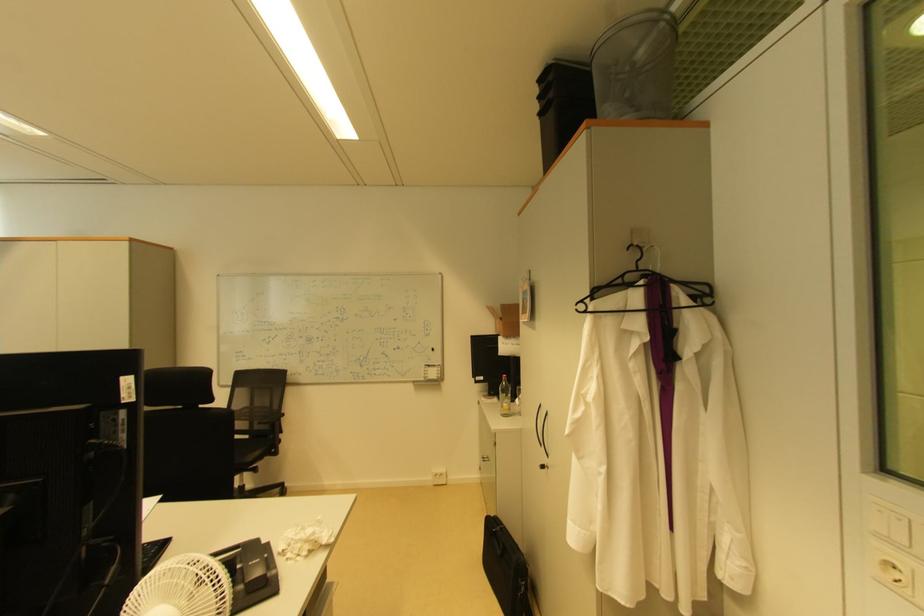
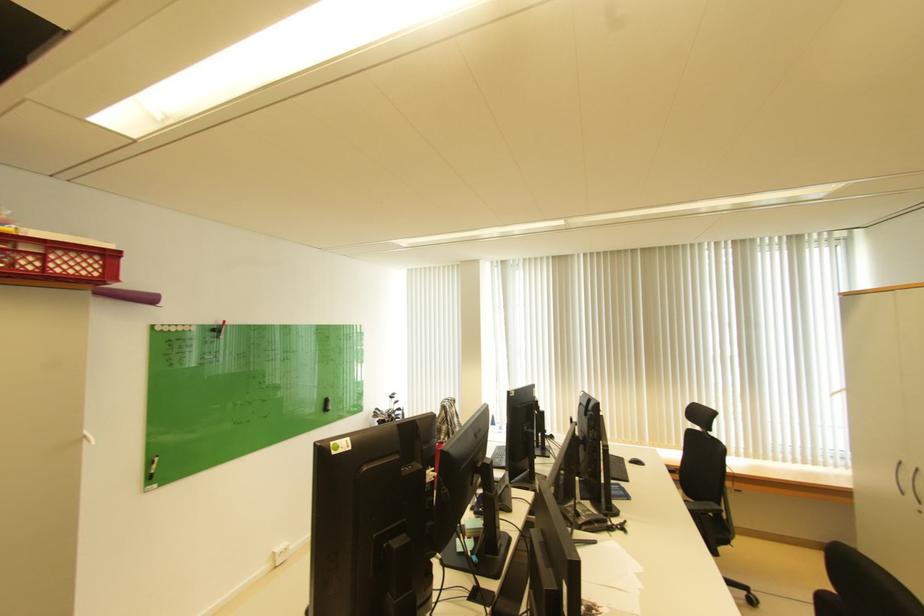
Question: The camera is either moving clockwise (left) or counter-clockwise (right) around the object. The first image is from the beginning of the video and the second image is from the end. Is the camera moving left or right when shooting the video?

Choices:
 (A) Left
 (B) Right

Answer: (B)